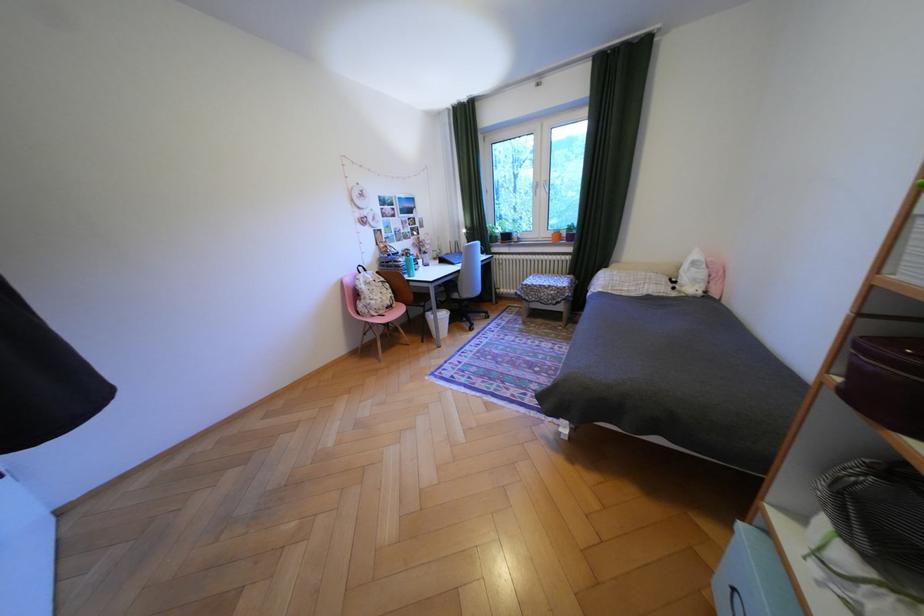
Where would you pull the blue box handle? Please return your answer as a coordinate pair (x, y).

(730, 594)